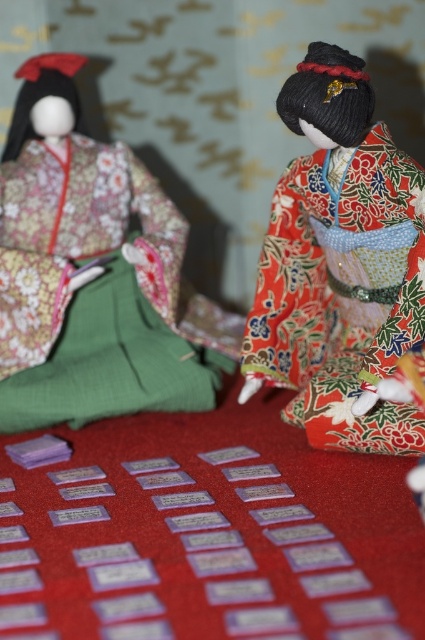
Which of these two, matte floral kimono at left or shiny red kimono doll at center, stands taller?

With more height is matte floral kimono at left.

Locate an element on the screen. The width and height of the screenshot is (425, 640). matte floral kimono at left is located at coordinates (93, 275).